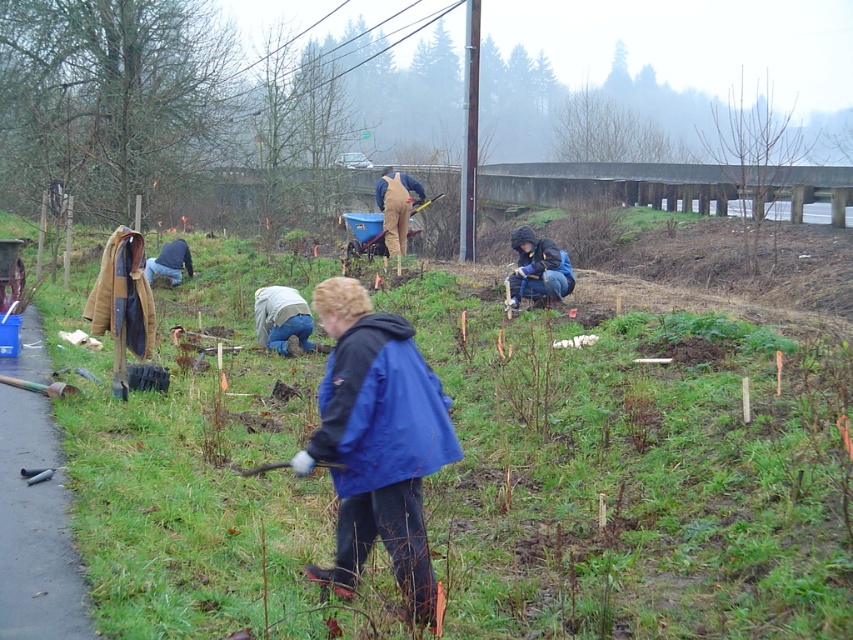
Is green grass at center closer to camera compared to dark blue jacket at center?

Yes.

Based on the photo, can you confirm if green grass at center is positioned above dark blue jacket at center?

Incorrect, green grass at center is not positioned above dark blue jacket at center.

This screenshot has width=853, height=640. What are the coordinates of `green grass at center` in the screenshot? It's located at (631, 474).

Looking at this image, between brown/canvas pants at center and blue denim jeans at lower left, which one appears on the right side from the viewer's perspective?

brown/canvas pants at center

Who is lower down, brown/canvas pants at center or blue denim jeans at lower left?

blue denim jeans at lower left is lower down.

Locate an element on the screen. The width and height of the screenshot is (853, 640). brown/canvas pants at center is located at coordinates (395, 205).

Locate an element on the screen. The height and width of the screenshot is (640, 853). brown/canvas pants at center is located at coordinates (395, 205).

Is point (440, 420) farther from camera compared to point (563, 289)?

No, it is in front of (563, 289).

Between point (376, 392) and point (547, 300), which one is positioned in front?

Point (376, 392)

Who is more distant from viewer, (418, 365) or (538, 296)?

Positioned behind is point (538, 296).

The image size is (853, 640). I want to click on blue fabric jacket at center, so click(376, 442).